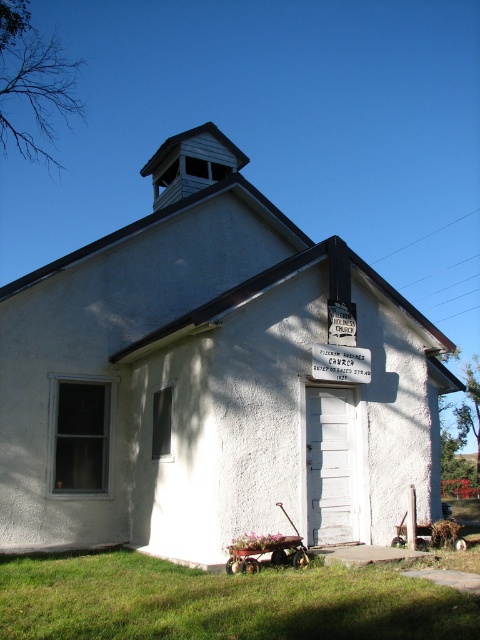
Between white stucco church at center and white plastic sign at center, which one is positioned lower?

white plastic sign at center is below.

Is white stucco church at center above white plastic sign at center?

Yes.

Who is more forward, (189, 532) or (359, 362)?

Positioned in front is point (189, 532).

You are a GUI agent. You are given a task and a screenshot of the screen. Output one action in this format:
    pyautogui.click(x=<x>, y=<y>)
    Task: Click on the white stucco church at center
    The height and width of the screenshot is (640, 480).
    Given the screenshot: What is the action you would take?
    pyautogui.click(x=211, y=380)